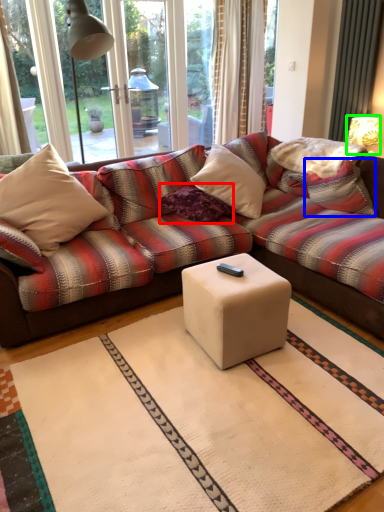
Question: Which object is positioned farthest from pillow (highlighted by a red box)? Select from pillow (highlighted by a blue box) and table lamp (highlighted by a green box).

Choices:
 (A) pillow
 (B) table lamp

Answer: (B)